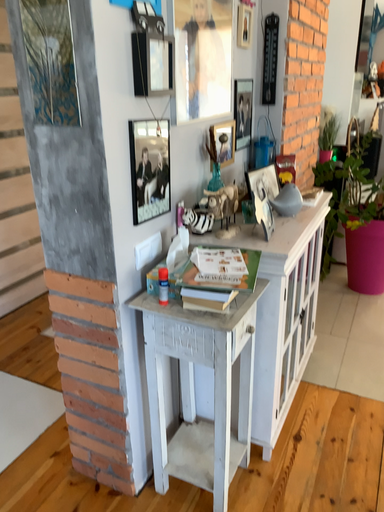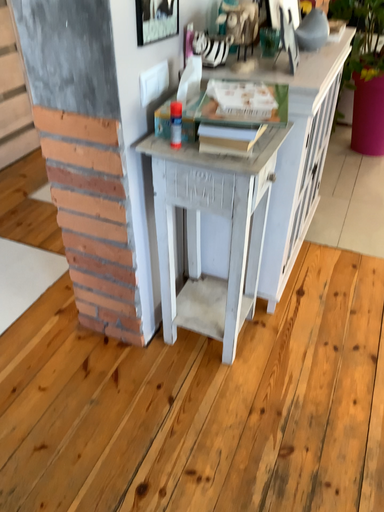
Question: Which way did the camera rotate in the video?

Choices:
 (A) rotated downward
 (B) rotated upward

Answer: (A)